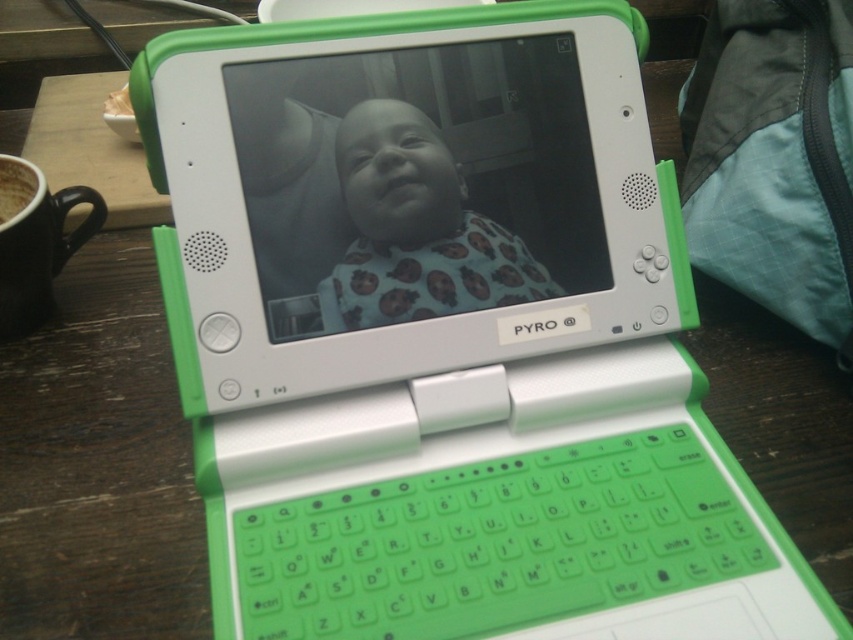
Question: Does blue fabric bib at center have a larger size compared to brown matte cup at upper left?

Choices:
 (A) no
 (B) yes

Answer: (B)

Question: Which object appears farthest from the camera in this image?

Choices:
 (A) brown matte cup at upper left
 (B) matte plastic screen at center
 (C) blue fabric bib at center

Answer: (A)

Question: Estimate the real-world distances between objects in this image. Which object is farther from the blue fabric bib at center?

Choices:
 (A) matte plastic screen at center
 (B) brown matte cup at upper left

Answer: (B)

Question: Which object appears farthest from the camera in this image?

Choices:
 (A) matte plastic screen at center
 (B) blue fabric bib at center
 (C) brown matte cup at upper left

Answer: (C)

Question: Does matte plastic screen at center appear on the left side of blue fabric bib at center?

Choices:
 (A) no
 (B) yes

Answer: (B)

Question: Is blue fabric bib at center to the left of brown matte cup at upper left from the viewer's perspective?

Choices:
 (A) yes
 (B) no

Answer: (B)